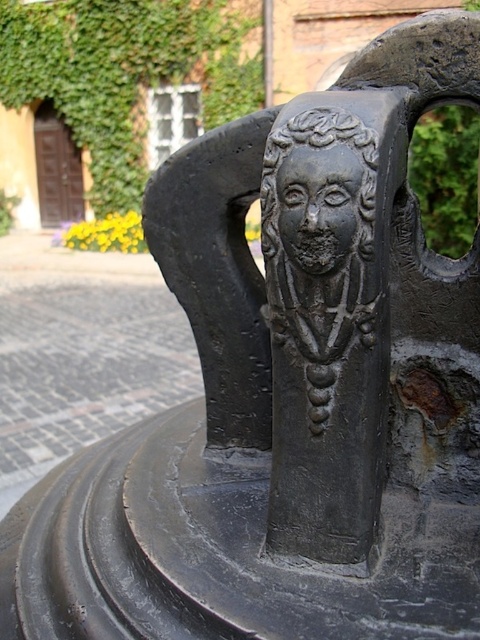
Question: Can you confirm if black matte deity at center is smaller than green ivy at upper left?

Choices:
 (A) no
 (B) yes

Answer: (B)

Question: Does green ivy at upper left come in front of matte black head at center?

Choices:
 (A) no
 (B) yes

Answer: (A)

Question: Among these points, which one is farthest from the camera?

Choices:
 (A) (312, 260)
 (B) (122, 29)
 (C) (286, 140)

Answer: (B)

Question: Where is green ivy at upper left located in relation to black stone face at center in the image?

Choices:
 (A) below
 (B) above

Answer: (B)

Question: Which point is closer to the camera taking this photo?

Choices:
 (A) (263, 209)
 (B) (381, 147)

Answer: (B)

Question: Which of the following is the closest to the observer?

Choices:
 (A) (335, 157)
 (B) (201, 1)
 (C) (276, 228)
 (D) (319, 289)

Answer: (A)